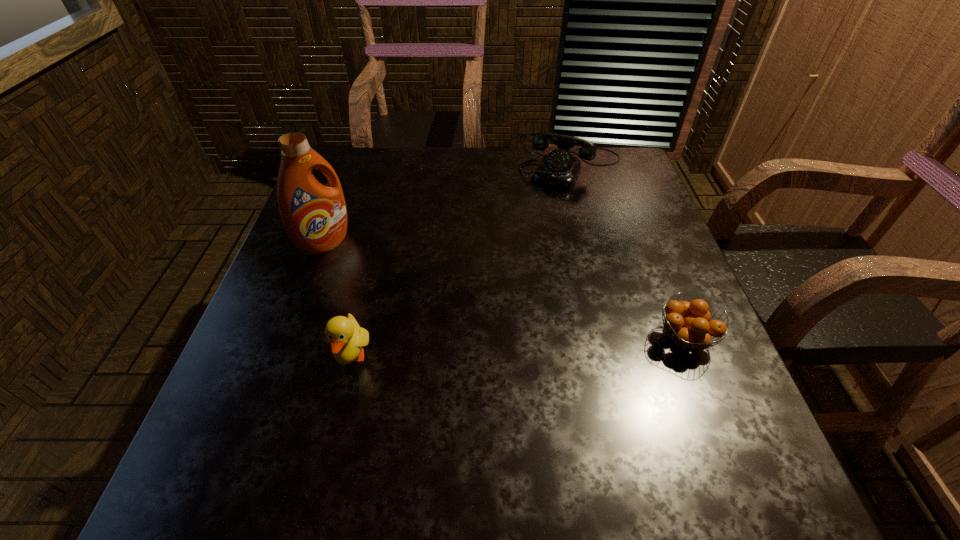
This screenshot has width=960, height=540. I want to click on empty space that is in between the second object from left to right and the farthest object, so click(x=462, y=262).

Locate an element on the screen. The image size is (960, 540). vacant area that lies between the duckling and the telephone is located at coordinates (462, 262).

I want to click on free spot between the telephone and the duckling, so click(462, 262).

Identify the location of free point between the orange fruit and the leftmost object. The width and height of the screenshot is (960, 540). pyautogui.click(x=505, y=291).

I want to click on free space between the second farthest object and the third object from right to left, so click(x=339, y=300).

Identify the location of object identified as the third closest to the tallest object. The height and width of the screenshot is (540, 960). (688, 323).

The width and height of the screenshot is (960, 540). Identify the location of the third closest object relative to the telephone. (346, 338).

Find the location of a particular element. free space that satisfies the following two spatial constraints: 1. on the front side of the shortest object; 2. on the left side of the leftmost object is located at coordinates (291, 339).

Identify the location of vacant space that satisfies the following two spatial constraints: 1. on the back side of the leftmost object; 2. on the left side of the telephone. The width and height of the screenshot is (960, 540). (353, 168).